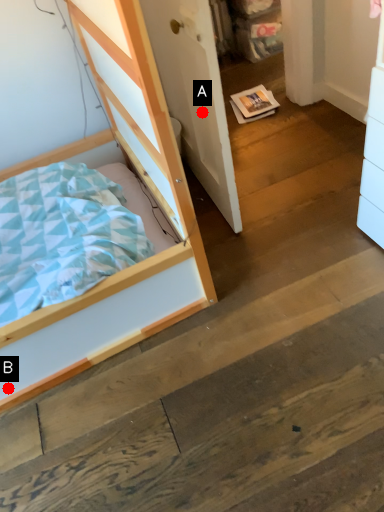
Question: Two points are circled on the image, labeled by A and B beside each circle. Which point is closer to the camera taking this photo?

Choices:
 (A) A is closer
 (B) B is closer

Answer: (B)